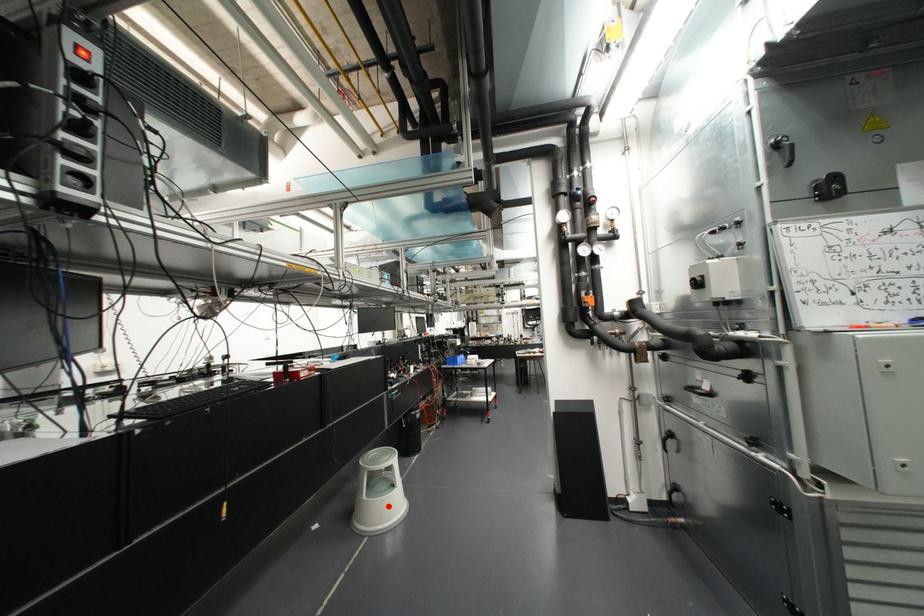
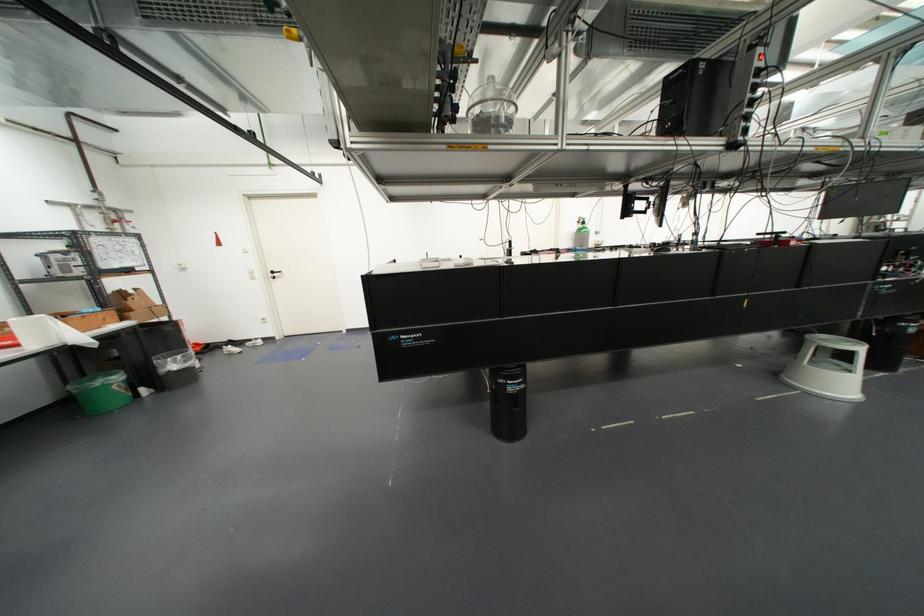
Where in the second image is the point corresponding to the highlighted location from the first image?

(834, 384)